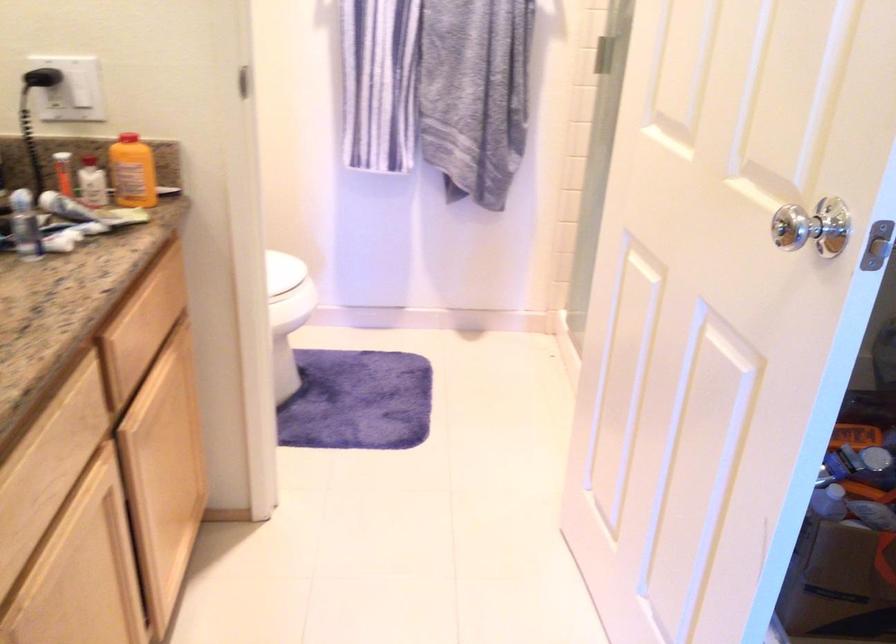
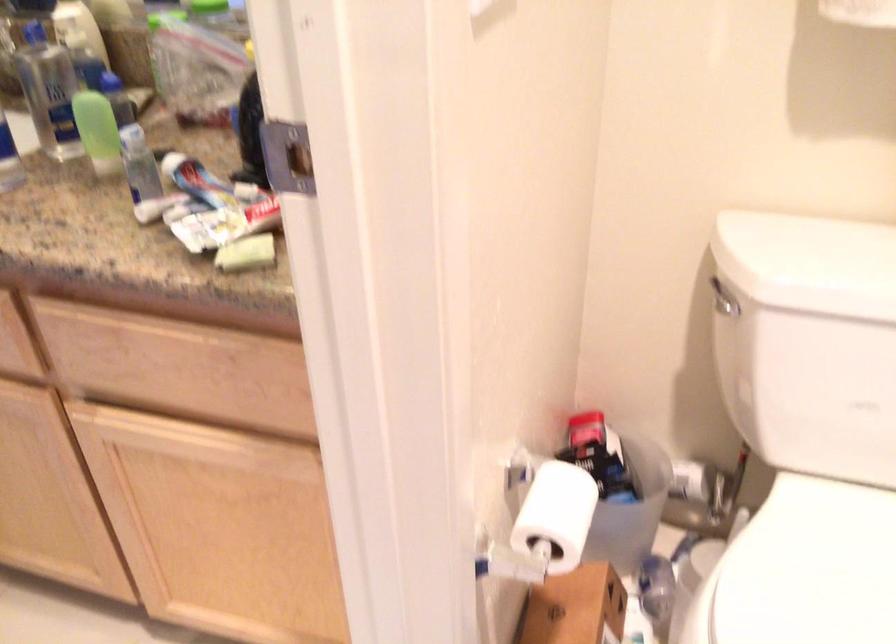
The point at (161, 316) is marked in the first image. Where is the corresponding point in the second image?

(177, 368)